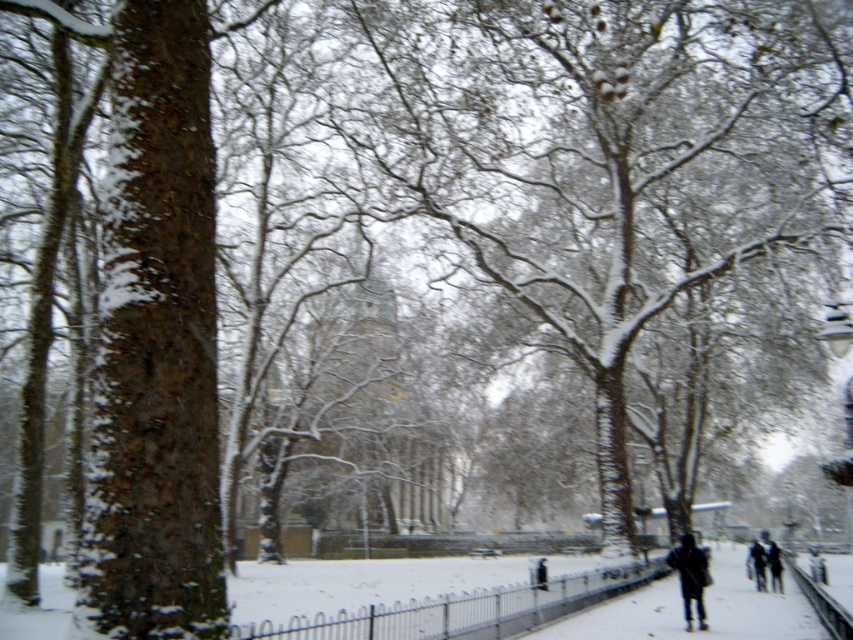
Question: Is dark blue jacket at lower right positioned before dark gray jacket at lower right?

Choices:
 (A) no
 (B) yes

Answer: (B)

Question: Among these points, which one is farthest from the camera?

Choices:
 (A) (686, 576)
 (B) (730, 556)
 (C) (755, 540)

Answer: (C)

Question: Is white snow at center above dark blue jacket at lower right?

Choices:
 (A) yes
 (B) no

Answer: (B)

Question: Can you confirm if dark blue jacket at lower right is wider than dark gray jacket at lower right?

Choices:
 (A) yes
 (B) no

Answer: (B)

Question: Which point appears farthest from the camera in this image?

Choices:
 (A) (706, 579)
 (B) (757, 580)
 (C) (809, 618)

Answer: (B)

Question: Which point is closer to the camera?

Choices:
 (A) dark blue jacket at lower right
 (B) dark gray jacket at lower right

Answer: (A)